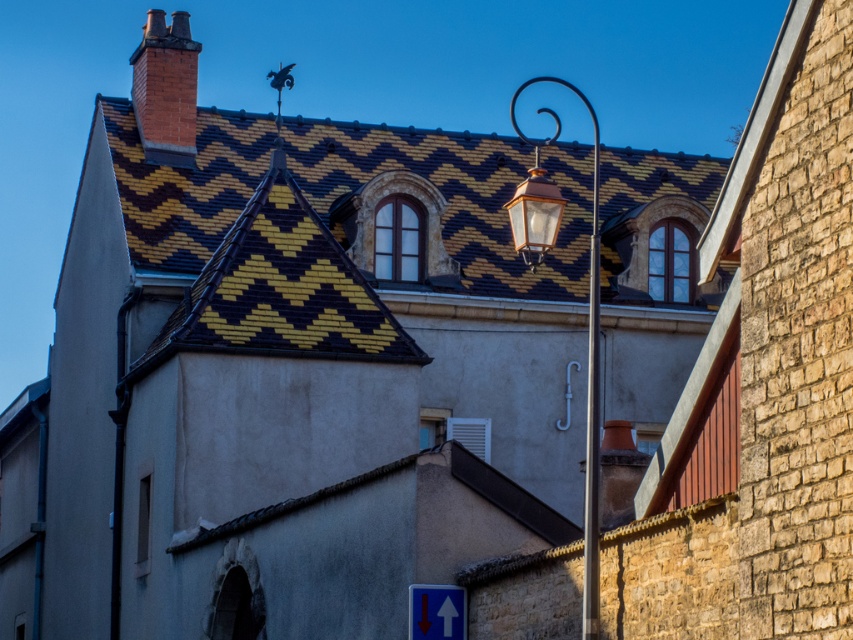
What do you see at coordinates (534, 214) in the screenshot?
I see `copper lantern at center` at bounding box center [534, 214].

From the picture: Can you confirm if copper lantern at center is taller than blue glossy arrow at lower center?

Yes.

Is point (521, 182) closer to camera compared to point (418, 611)?

Yes, point (521, 182) is in front of point (418, 611).

Locate an element on the screen. copper lantern at center is located at coordinates (534, 214).

Is polished silver pole at center shorter than copper lantern at center?

No.

Is point (598, 419) farther from camera compared to point (538, 228)?

Yes, point (598, 419) is behind point (538, 228).

Find the location of `polished silver pole at center`. polished silver pole at center is located at coordinates 592,416.

Is matte copper streetlight at center-right taller than blue glossy arrow at lower center?

Correct, matte copper streetlight at center-right is much taller as blue glossy arrow at lower center.

Is point (544, 218) positioned before point (425, 621)?

Yes, it is in front of point (425, 621).

Measure the distance between point (587, 406) and camera.

Point (587, 406) and camera are 255.44 feet apart from each other.

You are a GUI agent. You are given a task and a screenshot of the screen. Output one action in this format:
    pyautogui.click(x=<x>, y=<y>)
    Task: Click on the matte copper streetlight at center-right
    
    Given the screenshot: What is the action you would take?
    pyautogui.click(x=589, y=316)